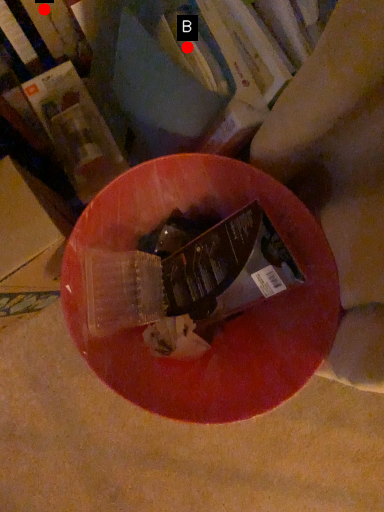
Question: Two points are circled on the image, labeled by A and B beside each circle. Which of the following is the closest to the observer?

Choices:
 (A) A is closer
 (B) B is closer

Answer: (B)